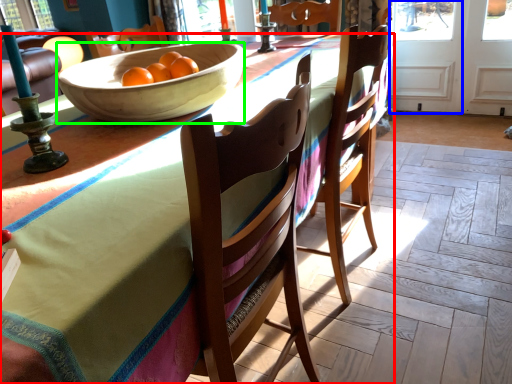
Question: Which is farther away from desk (highlighted by a red box)? screen door (highlighted by a blue box) or bowl (highlighted by a green box)?

Choices:
 (A) screen door
 (B) bowl

Answer: (A)